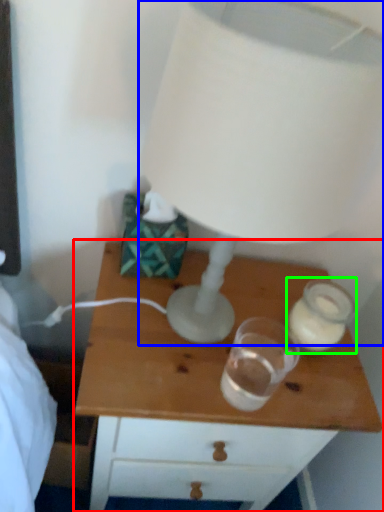
Question: Estimate the real-world distances between objects in this image. Which object is farther from nightstand (highlighted by a red box), lamp (highlighted by a blue box) or candle holder (highlighted by a green box)?

Choices:
 (A) lamp
 (B) candle holder

Answer: (A)